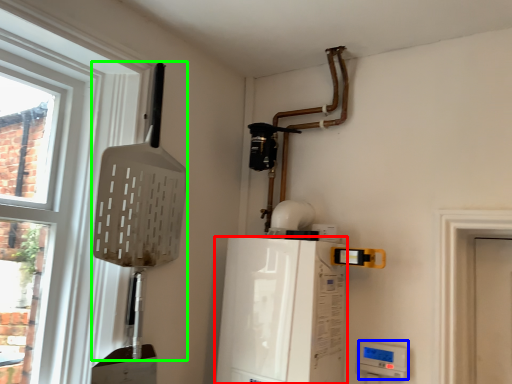
Question: Which object is positioned farthest from appliance (highlighted by a red box)? Select from appliance (highlighted by a blue box) and shovel (highlighted by a green box).

Choices:
 (A) appliance
 (B) shovel

Answer: (B)